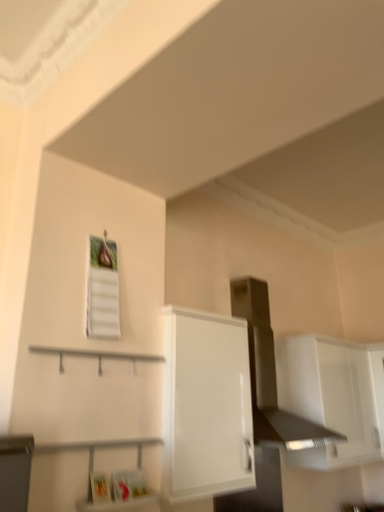
Question: Is white glossy cabinet at upper right, the first cabinetry when ordered from right to left, far from satin silver vent at upper center?

Choices:
 (A) no
 (B) yes

Answer: (A)

Question: Could you tell me if white glossy cabinet at upper right, marked as the 2th cabinetry in a front-to-back arrangement, is facing satin silver vent at upper center?

Choices:
 (A) yes
 (B) no

Answer: (B)

Question: From the image's perspective, is white glossy cabinet at upper right, the 1th cabinetry from the back, on satin silver vent at upper center?

Choices:
 (A) yes
 (B) no

Answer: (B)

Question: Can you confirm if white glossy cabinet at upper right, the second cabinetry when ordered from left to right, is shorter than satin silver vent at upper center?

Choices:
 (A) yes
 (B) no

Answer: (A)

Question: Is white glossy cabinet at upper right, the second cabinetry when ordered from left to right, located outside satin silver vent at upper center?

Choices:
 (A) no
 (B) yes

Answer: (B)

Question: Can you see white glossy cabinet at upper right, the first cabinetry when ordered from right to left, touching satin silver vent at upper center?

Choices:
 (A) no
 (B) yes

Answer: (A)

Question: Are white glossy cabinet at center, which appears as the 1th cabinetry when viewed from the front, and satin silver vent at upper center beside each other?

Choices:
 (A) no
 (B) yes

Answer: (A)

Question: Considering the relative sizes of white glossy cabinet at center, which appears as the 1th cabinetry when viewed from the front, and satin silver vent at upper center in the image provided, is white glossy cabinet at center, which appears as the 1th cabinetry when viewed from the front, thinner than satin silver vent at upper center?

Choices:
 (A) yes
 (B) no

Answer: (A)

Question: Is white glossy cabinet at center, which appears as the 1th cabinetry when viewed from the front, to the right of satin silver vent at upper center from the viewer's perspective?

Choices:
 (A) no
 (B) yes

Answer: (A)

Question: Can you confirm if white glossy cabinet at center, the 2th cabinetry when ordered from back to front, is positioned to the left of satin silver vent at upper center?

Choices:
 (A) no
 (B) yes

Answer: (B)

Question: Could you tell me if white glossy cabinet at center, the 2th cabinetry in the right-to-left sequence, is turned towards satin silver vent at upper center?

Choices:
 (A) yes
 (B) no

Answer: (B)

Question: Does white glossy cabinet at center, the 2th cabinetry in the right-to-left sequence, have a lesser height compared to satin silver vent at upper center?

Choices:
 (A) yes
 (B) no

Answer: (A)

Question: Is white glossy cabinet at upper right, marked as the 2th cabinetry in a front-to-back arrangement, taller than white glossy cabinet at center, the 2th cabinetry when ordered from back to front?

Choices:
 (A) no
 (B) yes

Answer: (A)